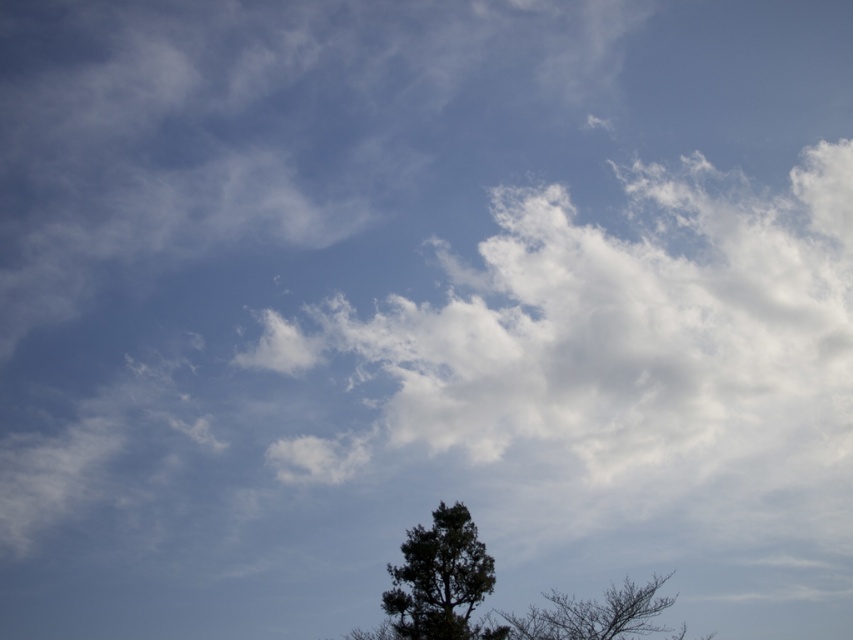
Between dark green textured tree at lower center and silhouette bark tree at lower right, which one appears on the right side from the viewer's perspective?

silhouette bark tree at lower right

Can you confirm if dark green textured tree at lower center is thinner than silhouette bark tree at lower right?

Correct, dark green textured tree at lower center's width is less than silhouette bark tree at lower right's.

Does point (403, 636) come farther from viewer compared to point (575, 604)?

No, it is not.

This screenshot has height=640, width=853. What are the coordinates of `dark green textured tree at lower center` in the screenshot? It's located at (440, 579).